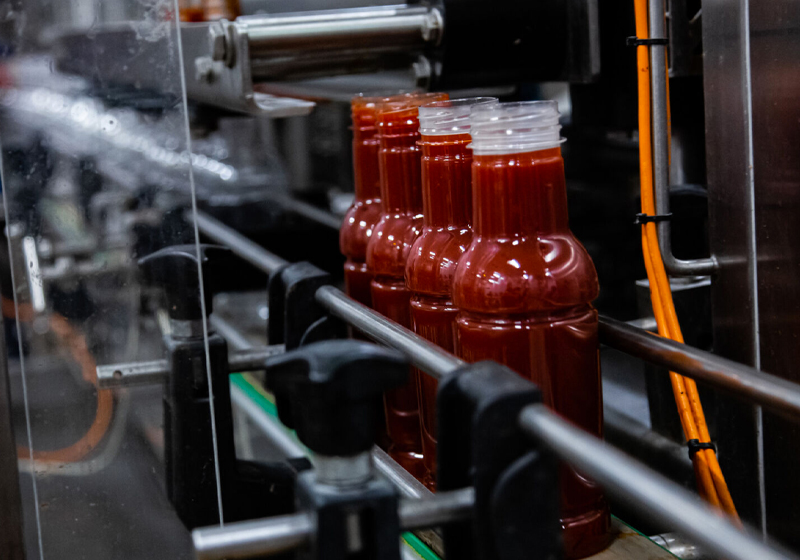
This screenshot has height=560, width=800. I want to click on knob, so click(348, 384).